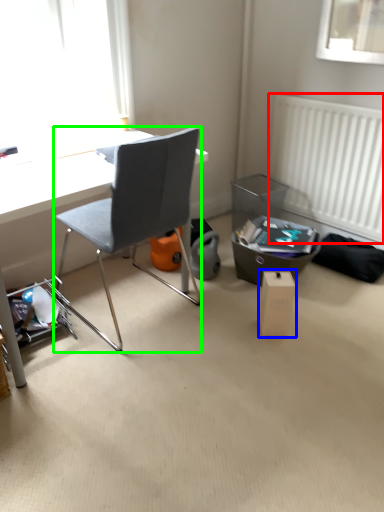
Question: Based on their relative distances, which object is farther from radiator (highlighted by a red box)? Choose from cardboard box (highlighted by a blue box) and chair (highlighted by a green box).

Choices:
 (A) cardboard box
 (B) chair

Answer: (B)